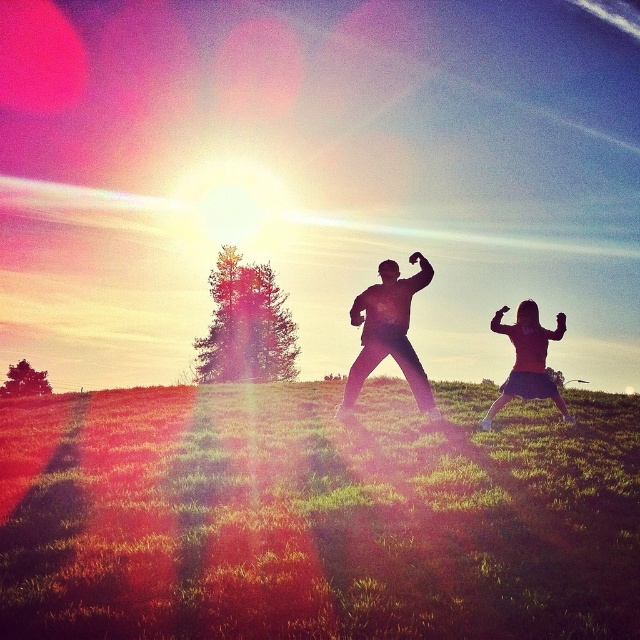
Between green grassy at center and matte pink skirt at lower right, which one has more height?

matte pink skirt at lower right

Looking at this image, who is more forward, (61, 540) or (554, 388)?

Point (61, 540) is in front.

The width and height of the screenshot is (640, 640). Identify the location of green grassy at center. pyautogui.click(x=316, y=515).

Find the location of a particular element. This screenshot has height=640, width=640. green grassy at center is located at coordinates (316, 515).

Is green grassy at center smaller than black matte pants at center?

No, green grassy at center is not smaller than black matte pants at center.

This screenshot has height=640, width=640. What do you see at coordinates (316, 515) in the screenshot? I see `green grassy at center` at bounding box center [316, 515].

This screenshot has height=640, width=640. I want to click on green grassy at center, so click(x=316, y=515).

Can you confirm if black matte pants at center is positioned below matte pink skirt at lower right?

No.

You are a GUI agent. You are given a task and a screenshot of the screen. Output one action in this format:
    pyautogui.click(x=<x>, y=<y>)
    Task: Click on the black matte pants at center
    
    Given the screenshot: What is the action you would take?
    pyautogui.click(x=388, y=332)

Between point (396, 289) and point (518, 326), which one is positioned behind?

The point (396, 289) is more distant.

The height and width of the screenshot is (640, 640). What are the coordinates of `black matte pants at center` in the screenshot? It's located at (388, 332).